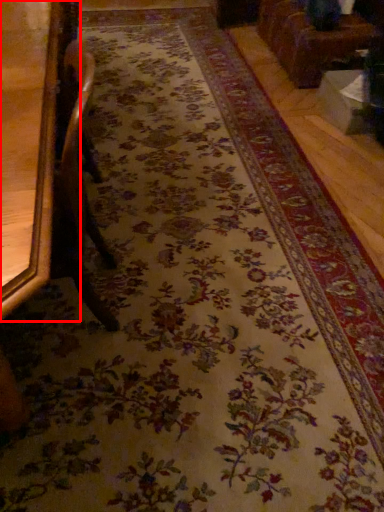
Question: From the image's perspective, what is the correct spatial positioning of furniture (annotated by the red box) in reference to furniture?

Choices:
 (A) above
 (B) below

Answer: (B)